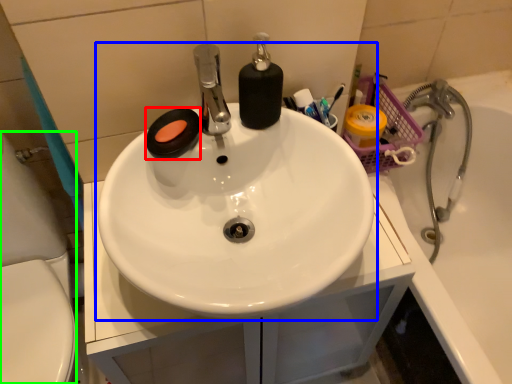
Question: Which is nearer to the soap (highlighted by a red box)? sink (highlighted by a blue box) or porcelain (highlighted by a green box).

Choices:
 (A) sink
 (B) porcelain

Answer: (A)